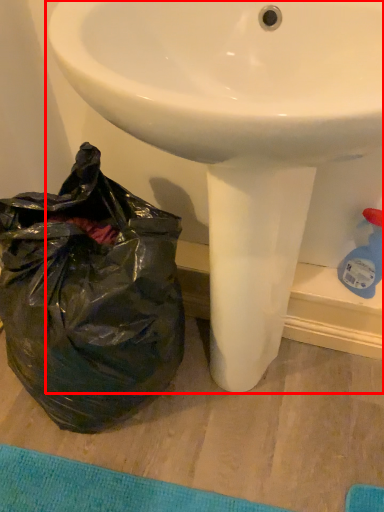
Question: Considering the relative positions of sink (annotated by the red box) and plastic bag in the image provided, where is sink (annotated by the red box) located with respect to the staircase?

Choices:
 (A) right
 (B) left

Answer: (A)